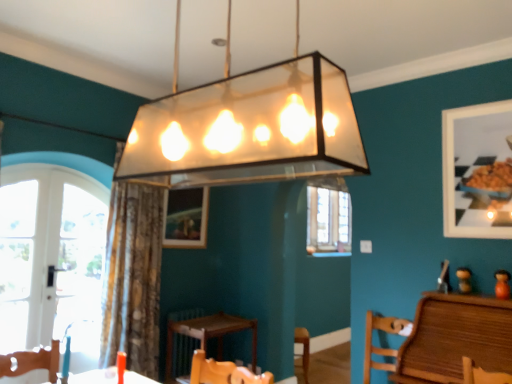
Question: Is brown textured curtain at center located outside wooden picture frame at center, marked as the 2th picture frame in a front-to-back arrangement?

Choices:
 (A) no
 (B) yes

Answer: (B)

Question: From the image's perspective, is brown textured curtain at center on wooden picture frame at center, which is counted as the 1th picture frame, starting from the back?

Choices:
 (A) no
 (B) yes

Answer: (A)

Question: Is brown textured curtain at center taller than wooden picture frame at center, the 2th picture frame in the right-to-left sequence?

Choices:
 (A) no
 (B) yes

Answer: (B)

Question: From a real-world perspective, does brown textured curtain at center stand above wooden picture frame at center, the 2th picture frame in the right-to-left sequence?

Choices:
 (A) no
 (B) yes

Answer: (A)

Question: Can you confirm if brown textured curtain at center is bigger than wooden picture frame at center, which is counted as the 1th picture frame, starting from the back?

Choices:
 (A) no
 (B) yes

Answer: (B)

Question: Is translucent glass pendant light at center wider or thinner than wooden chair at lower right?

Choices:
 (A) thin
 (B) wide

Answer: (A)

Question: Is translucent glass pendant light at center bigger or smaller than wooden chair at lower right?

Choices:
 (A) big
 (B) small

Answer: (A)

Question: Is translucent glass pendant light at center situated inside wooden chair at lower right or outside?

Choices:
 (A) outside
 (B) inside

Answer: (A)

Question: From the image's perspective, is translucent glass pendant light at center above or below wooden chair at lower right?

Choices:
 (A) above
 (B) below

Answer: (A)

Question: Is point (193, 327) closer or farther from the camera than point (369, 379)?

Choices:
 (A) farther
 (B) closer

Answer: (A)

Question: From the image's perspective, is wooden table at center located above or below wooden chair at lower right?

Choices:
 (A) above
 (B) below

Answer: (B)

Question: Do you think wooden table at center is within wooden chair at lower right, or outside of it?

Choices:
 (A) outside
 (B) inside

Answer: (A)

Question: Is wooden table at center in front of or behind wooden chair at lower right in the image?

Choices:
 (A) front
 (B) behind

Answer: (B)

Question: Visually, is white glass door at left positioned to the left or to the right of wooden picture frame at center, which ranks as the first picture frame in left-to-right order?

Choices:
 (A) left
 (B) right

Answer: (A)

Question: From the image's perspective, relative to wooden picture frame at center, which is counted as the 1th picture frame, starting from the back, is white glass door at left above or below?

Choices:
 (A) above
 (B) below

Answer: (B)